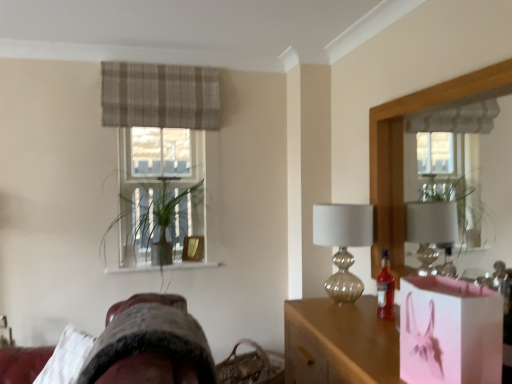
Question: From the image's perspective, is pink paper bag at lower right above or below pink glossy bag at center?

Choices:
 (A) above
 (B) below

Answer: (A)

Question: Is pink paper bag at lower right to the left or to the right of pink glossy bag at center in the image?

Choices:
 (A) left
 (B) right

Answer: (B)

Question: Which object is the farthest from the translucent glass bottle at right?

Choices:
 (A) plaid fabric curtain at upper center
 (B) woven brown basket at lower center
 (C) wooden frame mirror at right
 (D) velvet-like brown swivel chair at lower left
 (E) pink glossy bag at center

Answer: (A)

Question: Which of these objects is positioned closest to the translucent glass bottle at right?

Choices:
 (A) pink glossy bag at center
 (B) translucent glass table lamp at center right
 (C) woven brown basket at lower center
 (D) plaid fabric curtain at upper center
 (E) green leafy plant at center

Answer: (B)